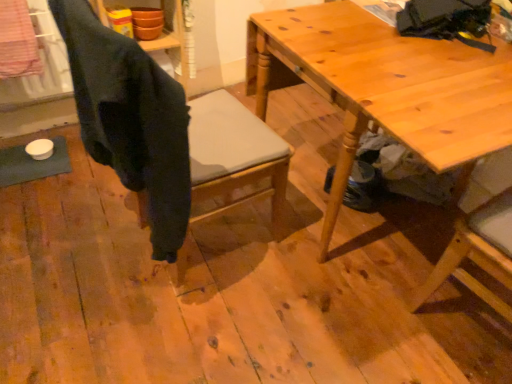
Question: Based on their sizes in the image, would you say dark gray fabric chair at center is bigger or smaller than wooden table at center?

Choices:
 (A) big
 (B) small

Answer: (B)

Question: From a real-world perspective, is dark gray fabric chair at center positioned above or below wooden table at center?

Choices:
 (A) below
 (B) above

Answer: (B)

Question: Based on their positions, is dark gray fabric chair at center located to the left or right of wooden table at center?

Choices:
 (A) left
 (B) right

Answer: (A)

Question: From the image's perspective, relative to dark gray fabric chair at center, is wooden table at center above or below?

Choices:
 (A) above
 (B) below

Answer: (A)

Question: Considering the positions of point (333, 29) and point (117, 114), is point (333, 29) closer or farther from the camera than point (117, 114)?

Choices:
 (A) closer
 (B) farther

Answer: (B)

Question: Is wooden table at center situated inside dark gray fabric chair at center or outside?

Choices:
 (A) outside
 (B) inside

Answer: (A)

Question: Is wooden table at center to the left or to the right of dark gray fabric chair at center in the image?

Choices:
 (A) right
 (B) left

Answer: (A)